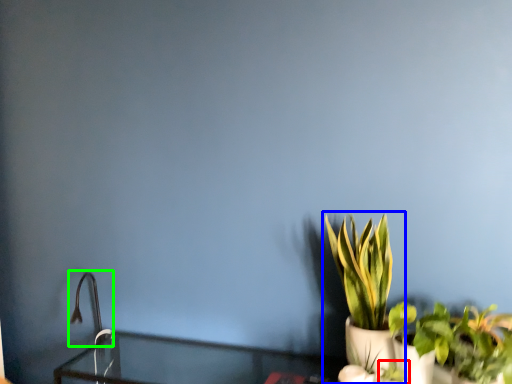
Question: Which object is positioned closest to plant (highlighted by a red box)? Select from houseplant (highlighted by a blue box) and faucet (highlighted by a green box).

Choices:
 (A) houseplant
 (B) faucet

Answer: (A)